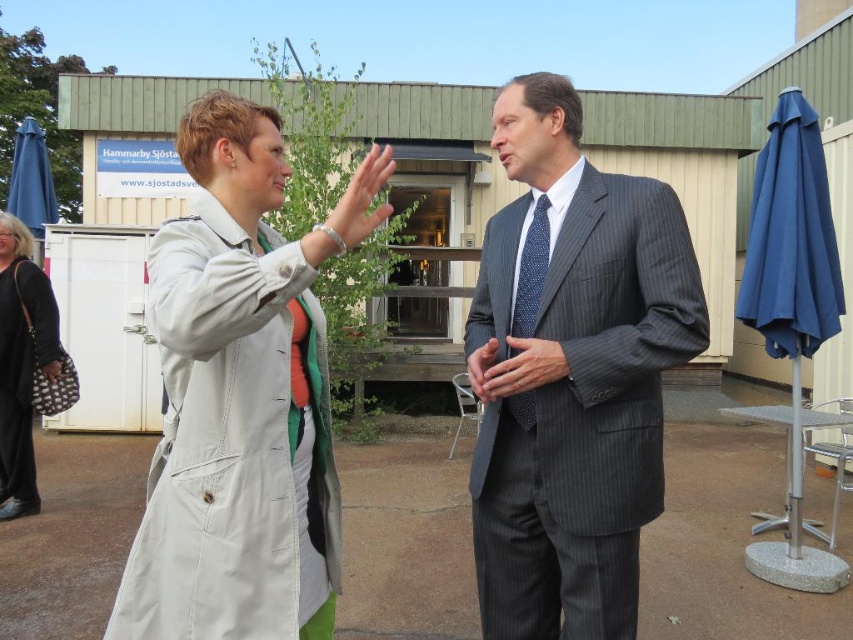
Question: Does black fabric purse at lower left appear on the right side of matte black handbag at lower left?

Choices:
 (A) no
 (B) yes

Answer: (A)

Question: Is smooth gray suit at center bigger than matte black handbag at lower left?

Choices:
 (A) yes
 (B) no

Answer: (A)

Question: Is light beige fabric hand at center to the left of matte black handbag at lower left from the viewer's perspective?

Choices:
 (A) yes
 (B) no

Answer: (B)

Question: Which object appears farthest from the camera in this image?

Choices:
 (A) light beige trench coat at center
 (B) black fabric purse at lower left
 (C) gray pinstripe suit at center

Answer: (B)

Question: Which of the following is the closest to the observer?

Choices:
 (A) smooth gray suit at center
 (B) light beige fabric hand at center

Answer: (B)

Question: Estimate the real-world distances between objects in this image. Which object is farther from the matte gray suit at center?

Choices:
 (A) blue fabric umbrella at right
 (B) gray pinstripe suit at center
 (C) matte black handbag at lower left
 (D) light beige fabric hand at center

Answer: (C)